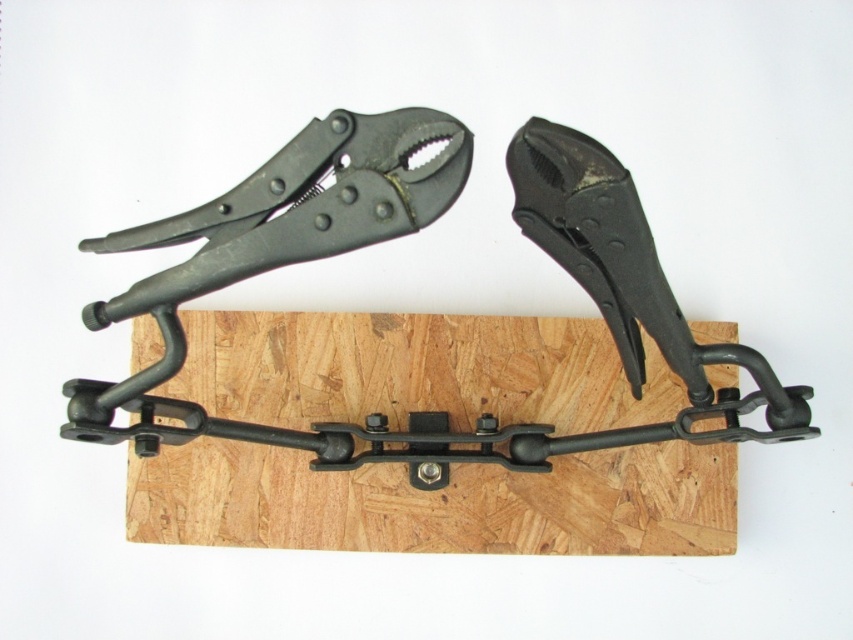
Question: Can you confirm if black metal plank at center is positioned to the right of matte black pliers at upper center?

Choices:
 (A) yes
 (B) no

Answer: (B)

Question: Can you confirm if black metal plank at center is positioned above matte black pliers at upper center?

Choices:
 (A) no
 (B) yes

Answer: (A)

Question: Which of the following is the farthest from the observer?

Choices:
 (A) matte black pliers at upper center
 (B) black metal plank at center

Answer: (B)

Question: Is black metal plank at center in front of matte black pliers at upper center?

Choices:
 (A) no
 (B) yes

Answer: (A)

Question: Which object is farther from the camera taking this photo?

Choices:
 (A) matte black pliers at upper center
 (B) black metal plank at center

Answer: (B)